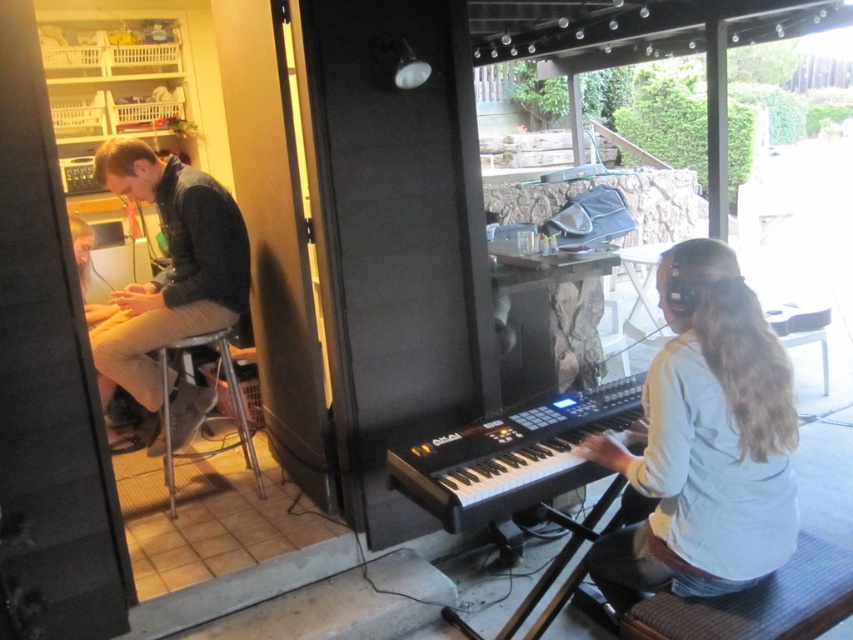
Question: Which point is farther to the camera?

Choices:
 (A) dark blue leather jacket at left
 (B) metallic silver stool at lower left

Answer: (B)

Question: Can you confirm if white matte shirt at right is smaller than black plastic keyboard at center?

Choices:
 (A) no
 (B) yes

Answer: (A)

Question: Estimate the real-world distances between objects in this image. Which object is closer to the dark blue leather jacket at left?

Choices:
 (A) black plastic keyboard at center
 (B) metallic silver stool at lower left

Answer: (B)

Question: Can you confirm if black plastic keyboard at center is positioned to the right of metallic silver stool at lower left?

Choices:
 (A) yes
 (B) no

Answer: (A)

Question: Which object appears farthest from the camera in this image?

Choices:
 (A) metallic silver stool at lower left
 (B) white matte shirt at right
 (C) dark blue leather jacket at left

Answer: (A)

Question: Does white matte shirt at right appear over metallic silver stool at lower left?

Choices:
 (A) yes
 (B) no

Answer: (A)